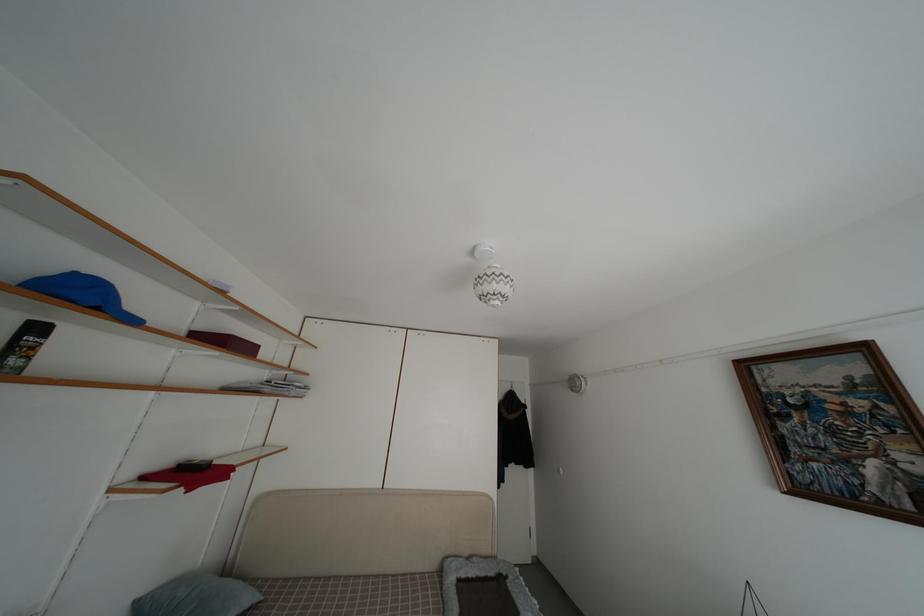
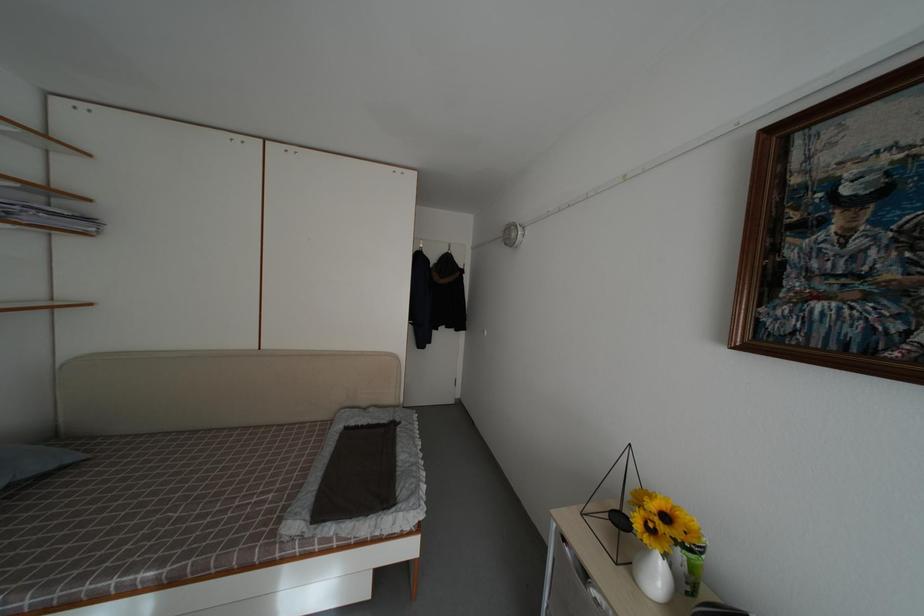
Find the pixel in the second image that matches (310,392) in the first image.

(94, 225)